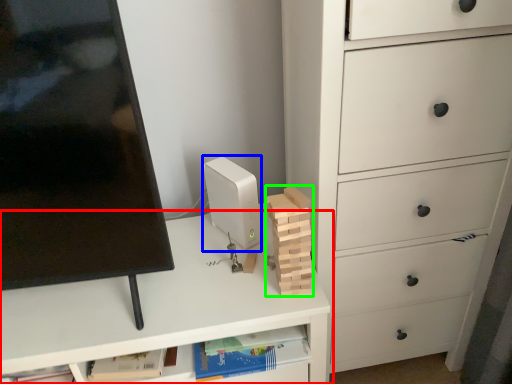
Question: Estimate the real-world distances between objects in this image. Which object is farther from desk (highlighted by a red box), desktop computer (highlighted by a blue box) or block (highlighted by a green box)?

Choices:
 (A) desktop computer
 (B) block

Answer: (B)